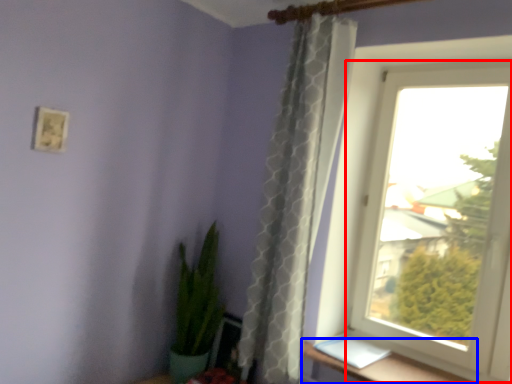
Question: Which object is further to the camera taking this photo, window (highlighted by a red box) or window sill (highlighted by a blue box)?

Choices:
 (A) window
 (B) window sill

Answer: (A)